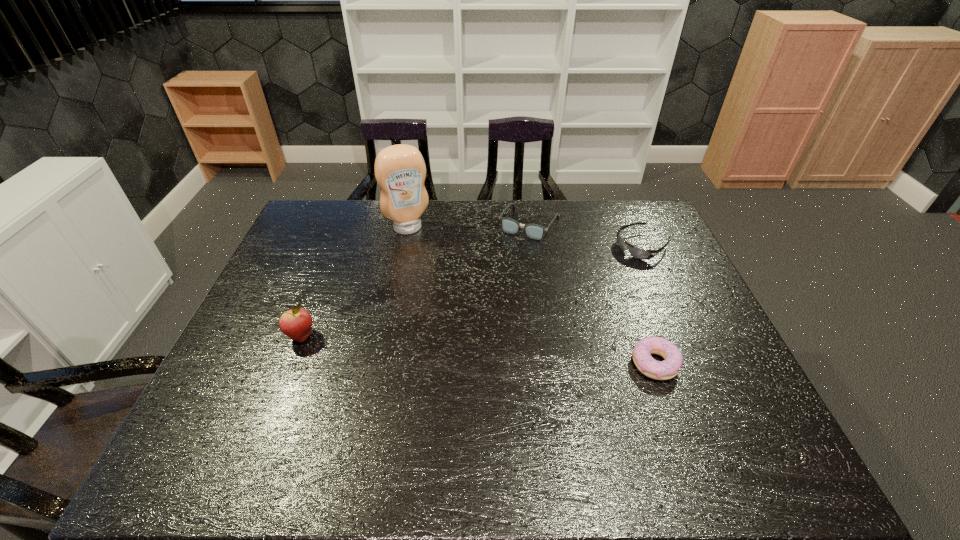
Image resolution: width=960 pixels, height=540 pixels. What are the coordinates of `the leftmost object` in the screenshot? It's located at (296, 323).

The height and width of the screenshot is (540, 960). In order to click on the second tallest object in this screenshot , I will do `click(296, 323)`.

Locate an element on the screen. The width and height of the screenshot is (960, 540). doughnut is located at coordinates (667, 369).

Where is `spectacles`? The image size is (960, 540). spectacles is located at coordinates (533, 231).

Find the location of a particular element. This screenshot has height=540, width=960. the third tallest object is located at coordinates (533, 231).

Image resolution: width=960 pixels, height=540 pixels. In order to click on condiment in this screenshot , I will do `click(400, 171)`.

Find the location of a particular element. the second object from left to right is located at coordinates (400, 171).

Where is `sunglasses`? The image size is (960, 540). sunglasses is located at coordinates (635, 252).

At what (x,y) coordinates should I click in order to perform the action: click on vacant space situated 0.170m on the back of the second tallest object. Please return your answer as a coordinate pair (x, y). Looking at the image, I should click on (323, 282).

Where is `free space located 0.280m on the back of the doughnut`? free space located 0.280m on the back of the doughnut is located at coordinates (623, 273).